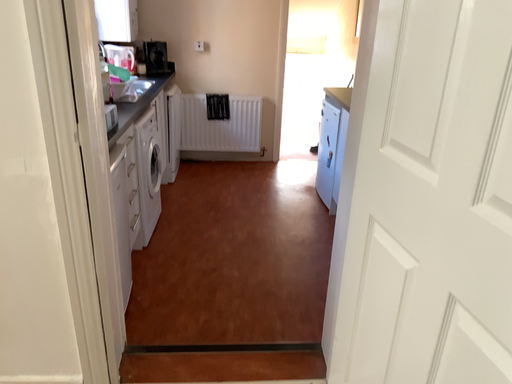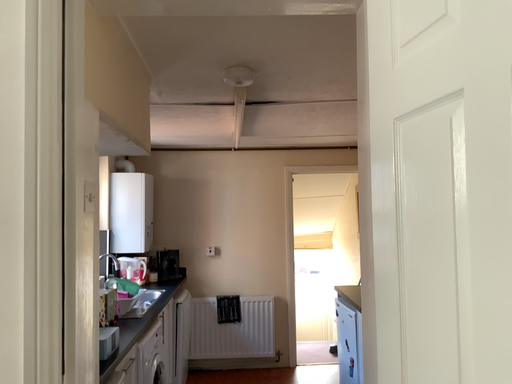
Question: Which way did the camera rotate in the video?

Choices:
 (A) rotated upward
 (B) rotated downward

Answer: (A)